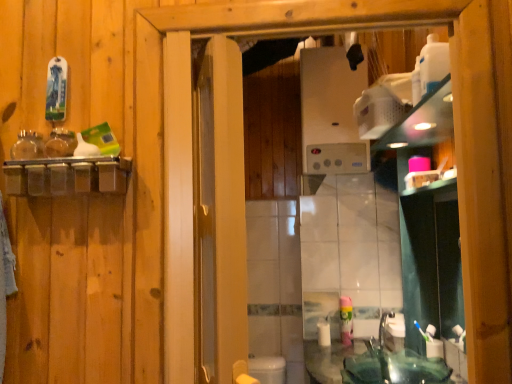
Question: In the image, is green glass sink at lower right positioned in front of or behind white matte toilet paper at lower center?

Choices:
 (A) behind
 (B) front

Answer: (B)

Question: Looking at their shapes, would you say green glass sink at lower right is wider or thinner than white matte toilet paper at lower center?

Choices:
 (A) wide
 (B) thin

Answer: (A)

Question: Which is nearer to the white plastic toothbrush at lower right?

Choices:
 (A) green glass sink at lower right
 (B) green plastic mouthwash at lower right
 (C) white matte toilet paper at lower center
 (D) satin silver boiler at upper center

Answer: (A)

Question: Estimate the real-world distances between objects in this image. Which object is farther from the green glass sink at lower right?

Choices:
 (A) satin silver boiler at upper center
 (B) green plastic mouthwash at lower right
 (C) white plastic toothbrush at lower right
 (D) white matte toilet paper at lower center

Answer: (A)